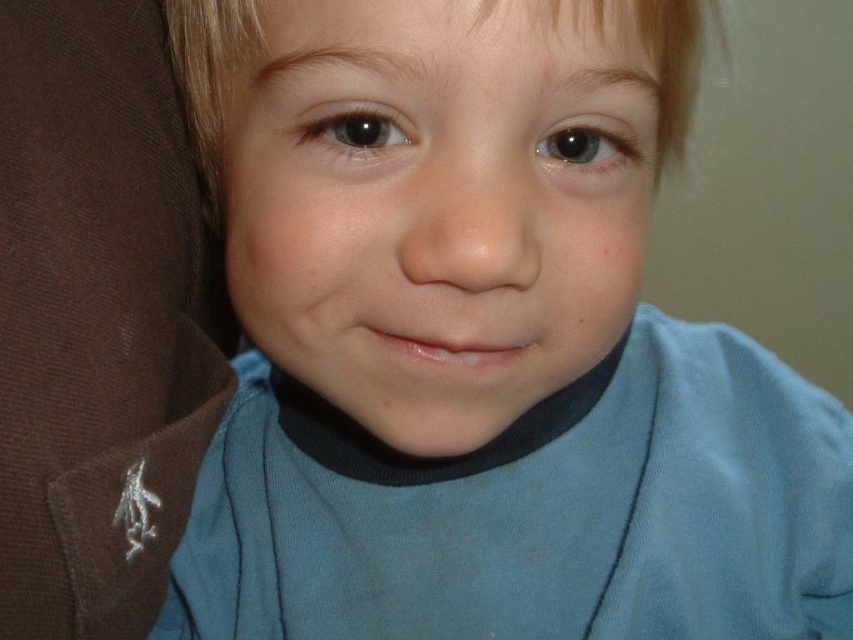
You are a photographer adjusting lighting for a portrait. You need to ensure that the matte brown fabric at left and the blonde smooth hair at center are both well illuminated. Based on their sizes, which object requires a wider light source to cover it adequately?

The matte brown fabric at left requires a wider light source because it is much taller than the blonde smooth hair at center, so a larger light source is needed to adequately illuminate its entire area.

What is the exact coordinate of the matte brown fabric at left in the image?

The matte brown fabric at left is located at point (97,317).

Based on the photo, you are a photographer adjusting the lighting for a portrait. You notice the matte brown fabric at left and the blonde smooth hair at center in your frame. Which object is closer to the bottom edge of the image?

The matte brown fabric at left is positioned under the blonde smooth hair at center, meaning it is closer to the bottom edge of the image.